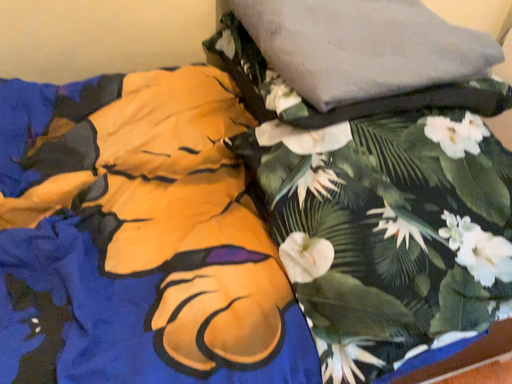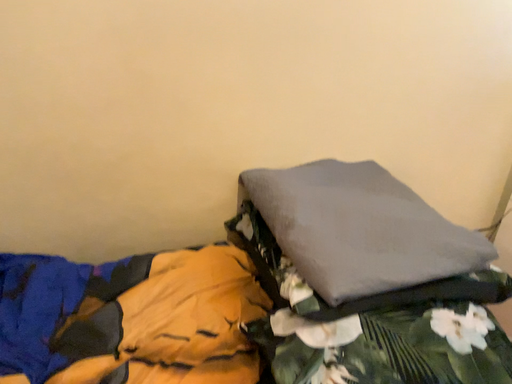
Question: Which way did the camera rotate in the video?

Choices:
 (A) rotated upward
 (B) rotated downward

Answer: (A)